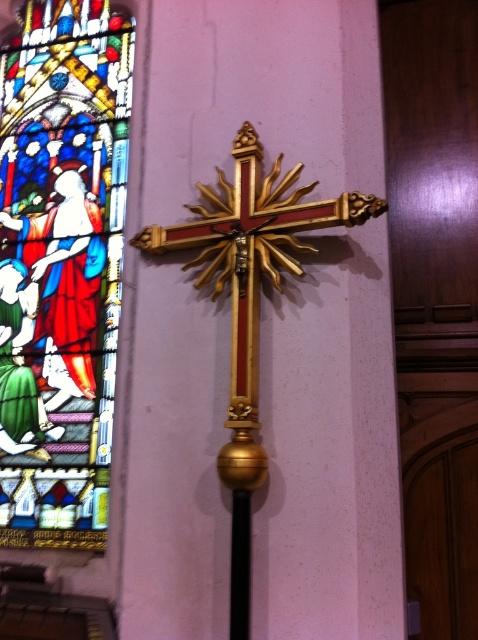
Question: Is stained glass window at left to the left of gold polished crucifix at center from the viewer's perspective?

Choices:
 (A) yes
 (B) no

Answer: (A)

Question: Does stained glass window at left have a lesser width compared to gold polished crucifix at center?

Choices:
 (A) yes
 (B) no

Answer: (A)

Question: Among these objects, which one is nearest to the camera?

Choices:
 (A) gold polished crucifix at center
 (B) stained glass window at left

Answer: (A)

Question: Among these objects, which one is nearest to the camera?

Choices:
 (A) stained glass window at left
 (B) gold polished crucifix at center

Answer: (B)

Question: Which of the following is the farthest from the observer?

Choices:
 (A) (253, 294)
 (B) (108, 477)

Answer: (B)

Question: Can you confirm if stained glass window at left is positioned to the right of gold polished crucifix at center?

Choices:
 (A) no
 (B) yes

Answer: (A)